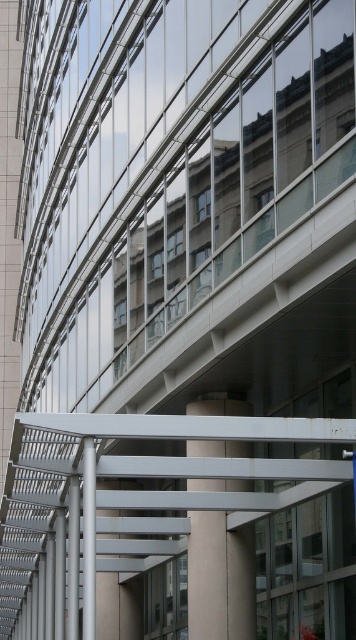
Question: Is white matte pillar at center above silver metallic pole at center?

Choices:
 (A) no
 (B) yes

Answer: (B)

Question: Is white matte pillar at center behind silver metallic pole at center?

Choices:
 (A) no
 (B) yes

Answer: (B)

Question: Can you confirm if white matte pillar at center is bigger than silver metallic pole at center?

Choices:
 (A) yes
 (B) no

Answer: (B)